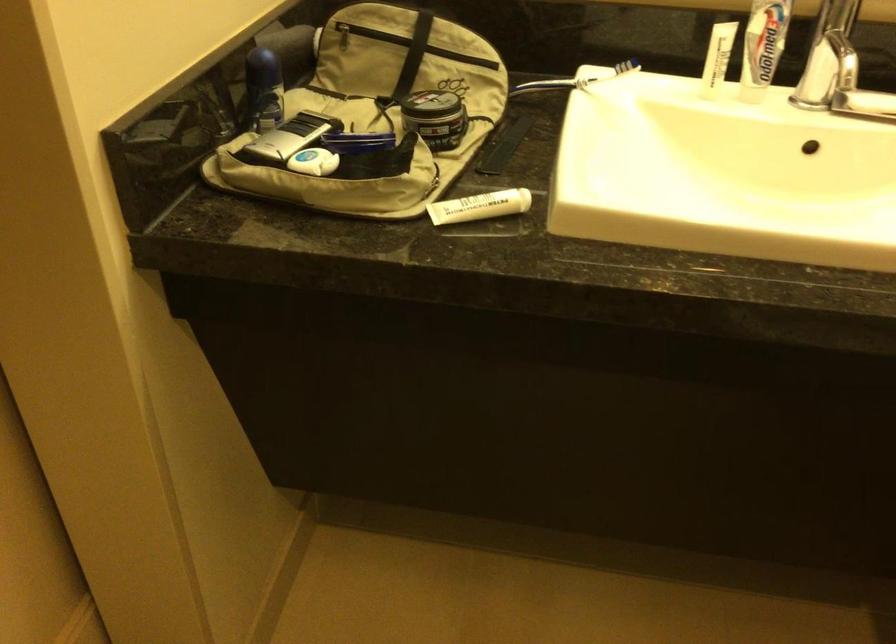
In order to click on black comb in this screenshot , I will do `click(503, 146)`.